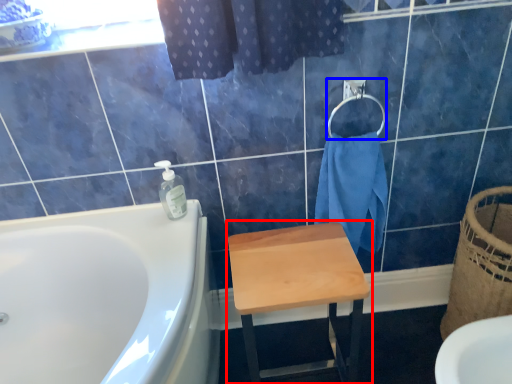
Question: Which of the following is the farthest to the observer, stool (highlighted by a red box) or towel bar (highlighted by a blue box)?

Choices:
 (A) stool
 (B) towel bar

Answer: (B)